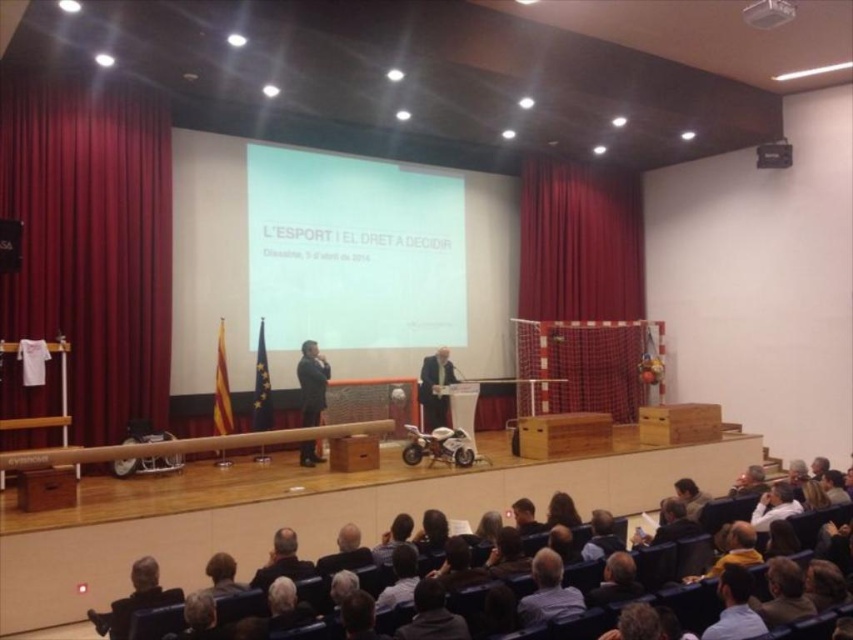
Is point (54, 88) closer to camera compared to point (547, 180)?

Yes.

Is red velvet curtain at left above curtain at center?

Indeed, red velvet curtain at left is positioned over curtain at center.

The width and height of the screenshot is (853, 640). Describe the element at coordinates (91, 243) in the screenshot. I see `red velvet curtain at left` at that location.

This screenshot has height=640, width=853. In order to click on red velvet curtain at left in this screenshot , I will do `click(91, 243)`.

Who is more distant from viewer, [401,259] or [321,365]?

The point [401,259] is behind.

Who is taller, white matte projection screen at center or dark suit at center?

white matte projection screen at center

You are a GUI agent. You are given a task and a screenshot of the screen. Output one action in this format:
    pyautogui.click(x=<x>, y=<y>)
    Task: Click on the white matte projection screen at center
    
    Given the screenshot: What is the action you would take?
    pyautogui.click(x=352, y=252)

Does curtain at center have a lesser width compared to dark suit at center?

No, curtain at center is not thinner than dark suit at center.

Between point (572, 380) and point (317, 424), which one is positioned behind?

Point (572, 380)

Is point (552, 348) farther from camera compared to point (312, 456)?

That is True.

Where is `curtain at center`? The image size is (853, 640). curtain at center is located at coordinates (581, 284).